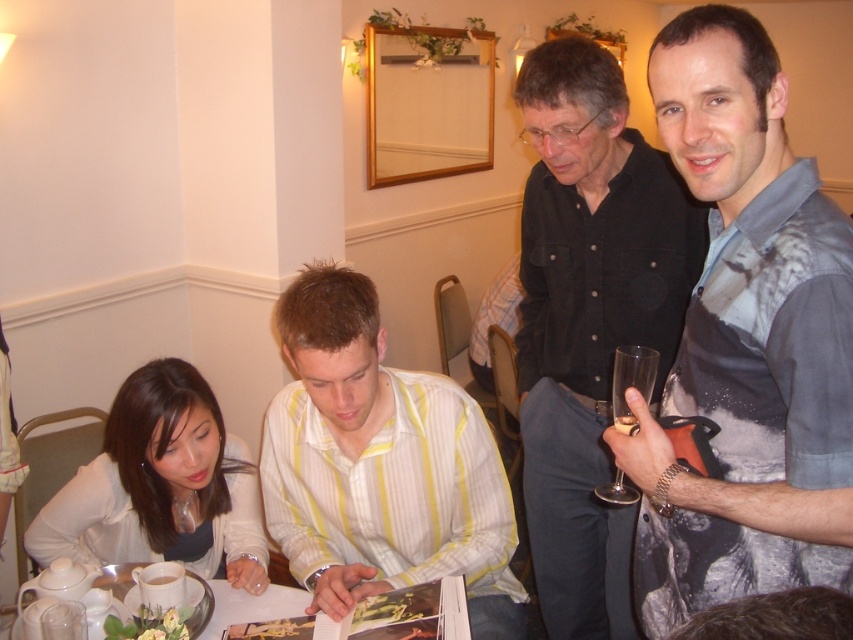
You are standing at the entrance of the dining area and want to locate the person wearing the yellow striped shirt at center. According to the coordinates provided, in which direction should you look to find this person?

You should look towards the center of the image, as the yellow striped shirt at center is located at point coordinates (380, 465), which corresponds to the central area of the scene.

You are at a social gathering and want to greet the person wearing the yellow striped shirt at center. Which direction should you move relative to the matte white sweater at lower left?

The yellow striped shirt at center is to the right of the matte white sweater at lower left, so you should move to the right of the matte white sweater at lower left to reach the person wearing the yellow striped shirt at center.